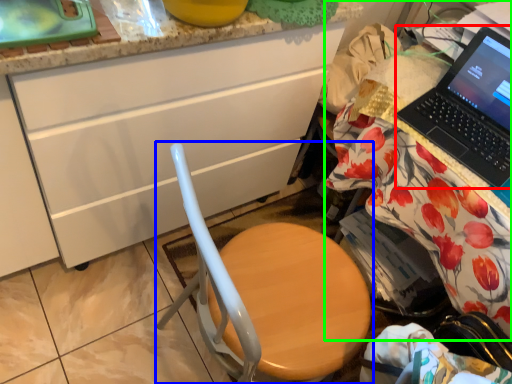
Question: Based on their relative distances, which object is nearer to laptop (highlighted by a red box)? Choose from chair (highlighted by a blue box) and desk (highlighted by a green box).

Choices:
 (A) chair
 (B) desk

Answer: (B)